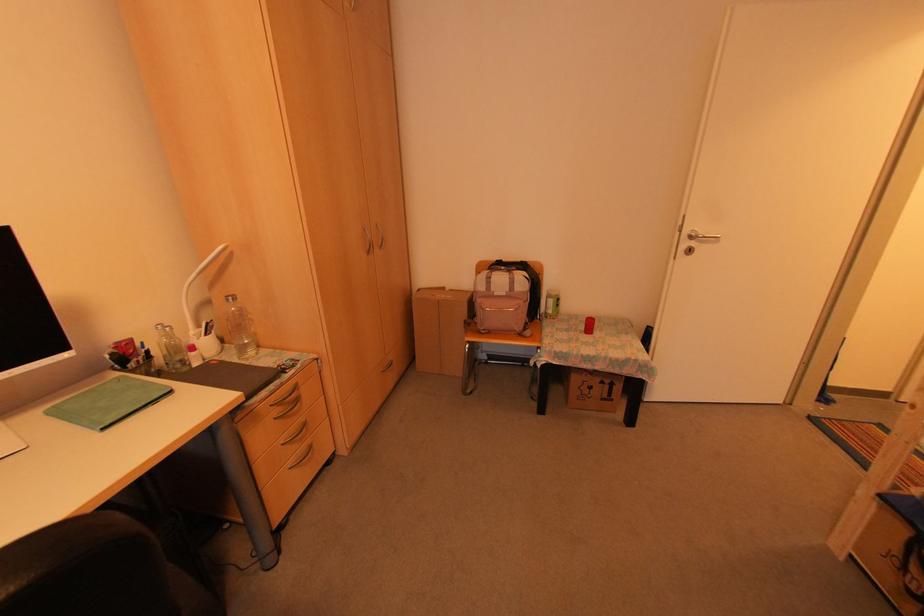
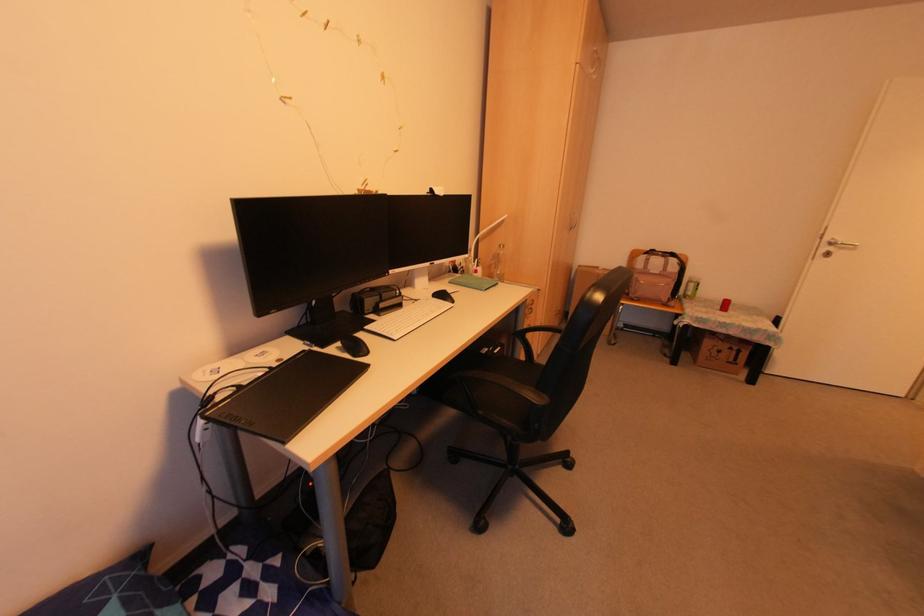
In the second image, find the point that corresponds to point (197, 328) in the first image.

(472, 262)